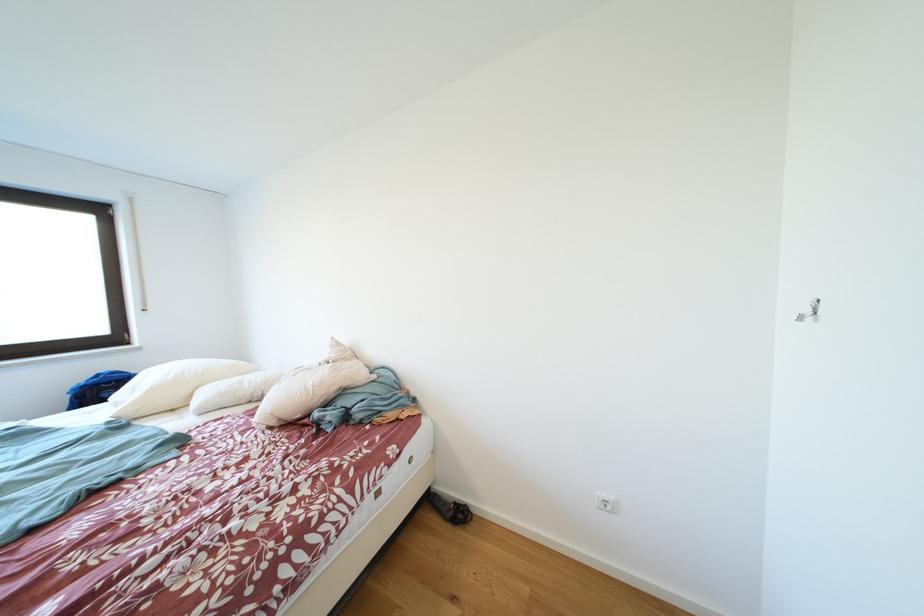
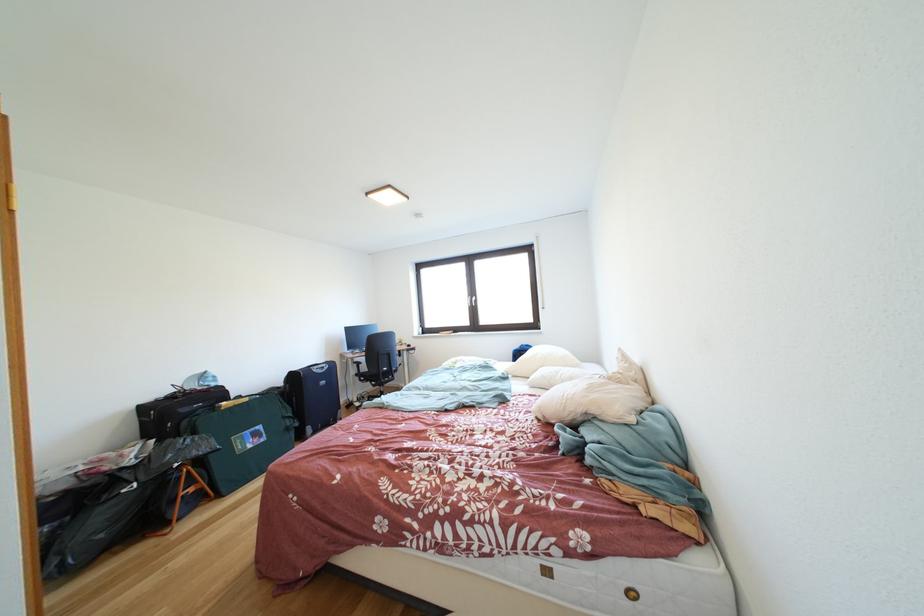
The point at (282, 428) is marked in the first image. Where is the corresponding point in the second image?

(549, 421)